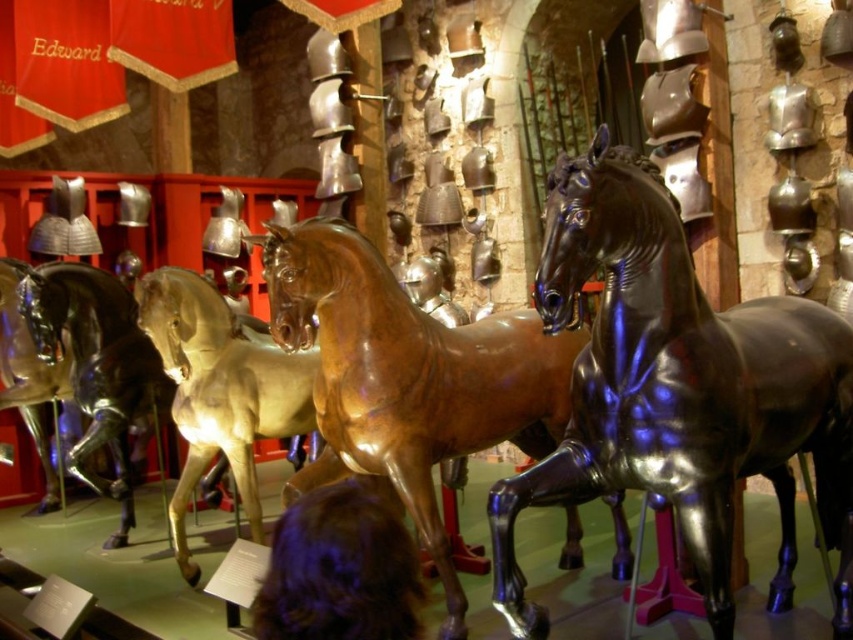
You are a tour guide leading a group through the museum. You need to move a 3.5 meter long ladder from the entrance to the storage room located behind the statues. The path between the glossy black horse at center and the glossy metallic horse at center is the only route available. Can you safely transport the ladder through this path without touching the statues?

The distance between the glossy black horse at center and the glossy metallic horse at center is 3.06 meters. Since the ladder is 3.5 meters long, it cannot fit through the 3.06 meter gap as it is shorter than the ladder. Therefore, the ladder cannot be safely transported through this path without touching the statues.

You are a visitor at the museum and want to take a photo of the brown hair at lower center and the glossy metallic horse at center. Which object should you focus on first if you want to capture both in the same frame without moving your camera?

You should focus on the glossy metallic horse at center first because it is taller than the brown hair at lower center, so it will be easier to frame both by adjusting the camera angle to include the shorter object.